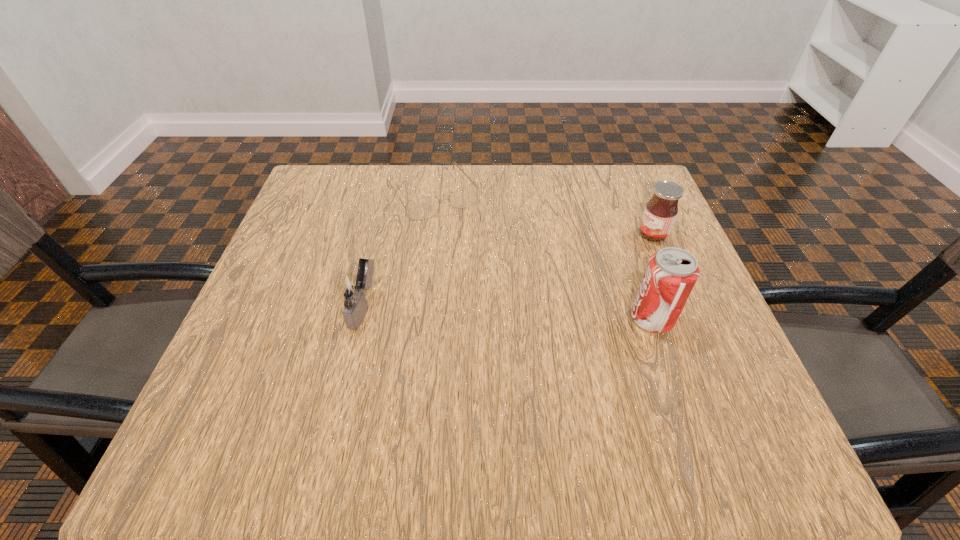
The image size is (960, 540). I want to click on vacant space located 0.110m on the label side of the jam, so click(x=603, y=255).

Find the location of a particular element. The height and width of the screenshot is (540, 960). blank area located 0.160m on the label side of the jam is located at coordinates (585, 262).

Locate an element on the screen. This screenshot has height=540, width=960. vacant space situated on the label side of the jam is located at coordinates (607, 253).

Find the location of a particular element. The height and width of the screenshot is (540, 960). object situated at the far edge is located at coordinates (424, 207).

The width and height of the screenshot is (960, 540). I want to click on soda can positioned at the right edge, so click(x=671, y=274).

The width and height of the screenshot is (960, 540). I want to click on jam that is positioned at the right edge, so click(660, 213).

In the image, there is a desktop. In order to click on free space at the far edge in this screenshot , I will do `click(583, 181)`.

The height and width of the screenshot is (540, 960). What are the coordinates of `free space at the left edge of the desktop` in the screenshot? It's located at (343, 240).

Find the location of a particular element. Image resolution: width=960 pixels, height=540 pixels. vacant space at the right edge of the desktop is located at coordinates (620, 248).

Where is `free space at the far left corner of the desktop`? Image resolution: width=960 pixels, height=540 pixels. free space at the far left corner of the desktop is located at coordinates (301, 200).